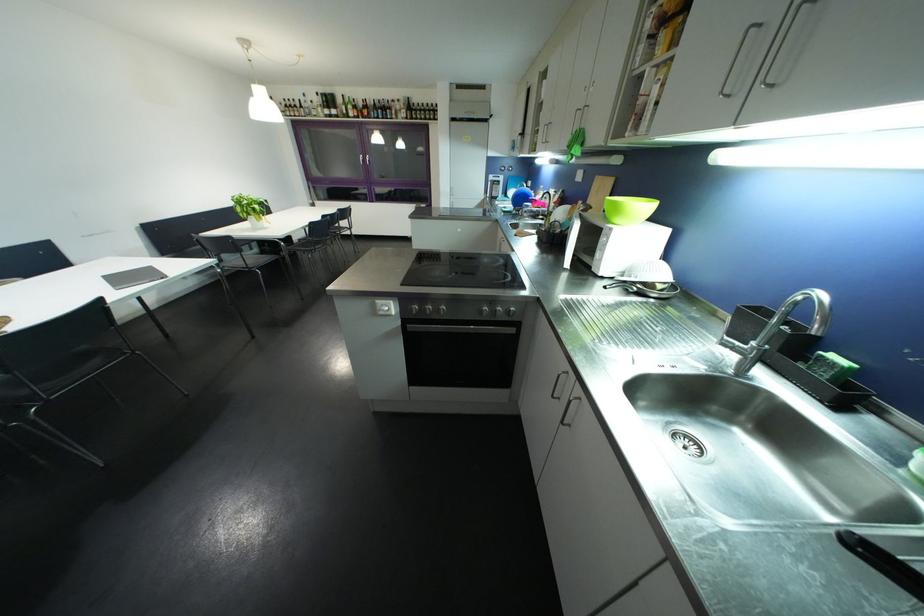
Describe the element at coordinates (628, 209) in the screenshot. This screenshot has width=924, height=616. I see `a lime green bowl` at that location.